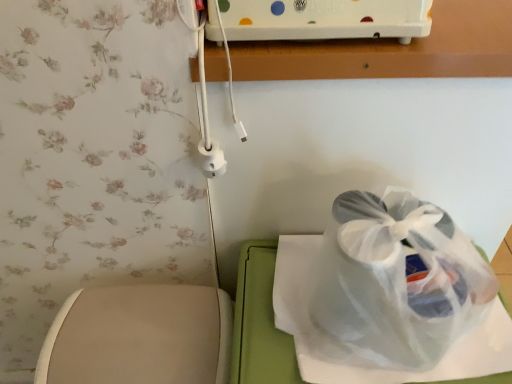
Question: Considering the positions of beige fabric toilet at lower left and transparent plastic bag at center in the image, is beige fabric toilet at lower left taller or shorter than transparent plastic bag at center?

Choices:
 (A) tall
 (B) short

Answer: (A)

Question: From the image's perspective, relative to transparent plastic bag at center, is beige fabric toilet at lower left above or below?

Choices:
 (A) below
 (B) above

Answer: (A)

Question: Relative to transparent plastic bag at center, is beige fabric toilet at lower left in front or behind?

Choices:
 (A) behind
 (B) front

Answer: (A)

Question: Looking at their shapes, would you say transparent plastic bag at center is wider or thinner than beige fabric toilet at lower left?

Choices:
 (A) wide
 (B) thin

Answer: (A)

Question: Considering their positions, is transparent plastic bag at center located in front of or behind beige fabric toilet at lower left?

Choices:
 (A) front
 (B) behind

Answer: (A)

Question: Considering the positions of point (402, 196) and point (190, 342), is point (402, 196) closer or farther from the camera than point (190, 342)?

Choices:
 (A) closer
 (B) farther

Answer: (A)

Question: Is transparent plastic bag at center spatially inside beige fabric toilet at lower left, or outside of it?

Choices:
 (A) inside
 (B) outside

Answer: (B)